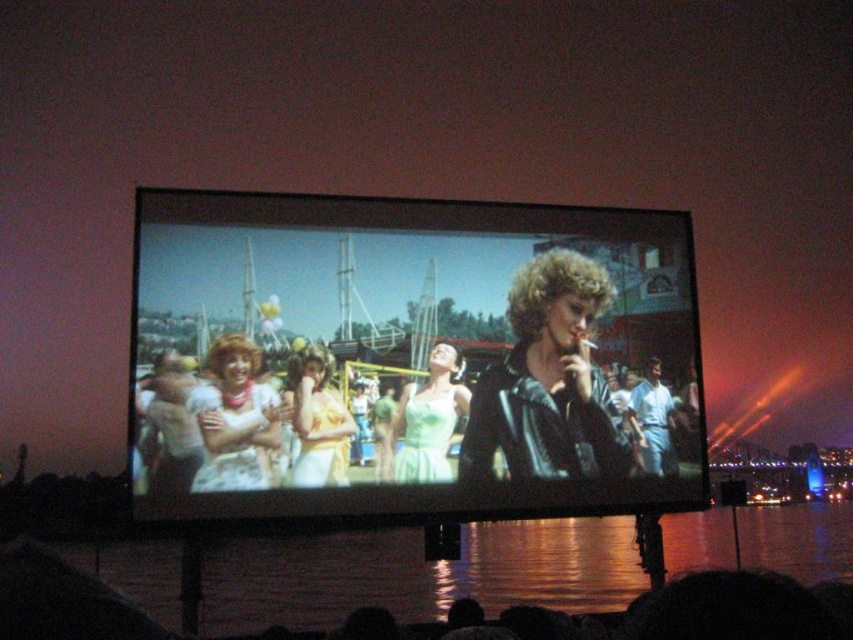
Question: Estimate the real-world distances between objects in this image. Which object is closer to the black leather jacket at center?

Choices:
 (A) light green satin dress at center
 (B) matte yellow dress at center
 (C) matte white dress at center

Answer: (A)

Question: Can you confirm if shiny black screen at center is smaller than matte white dress at center?

Choices:
 (A) yes
 (B) no

Answer: (B)

Question: Observing the image, what is the correct spatial positioning of matte white dress at center in reference to white cotton shirt at center?

Choices:
 (A) above
 (B) below

Answer: (A)

Question: Estimate the real-world distances between objects in this image. Which object is farther from the matte white dress at center?

Choices:
 (A) shiny black screen at center
 (B) glistening water at bottom
 (C) light green satin dress at center

Answer: (B)

Question: Can you confirm if glistening water at bottom is positioned above light green satin dress at center?

Choices:
 (A) yes
 (B) no

Answer: (B)

Question: Which point is closer to the camera taking this photo?

Choices:
 (A) (260, 424)
 (B) (651, 428)
 (C) (607, 440)

Answer: (A)